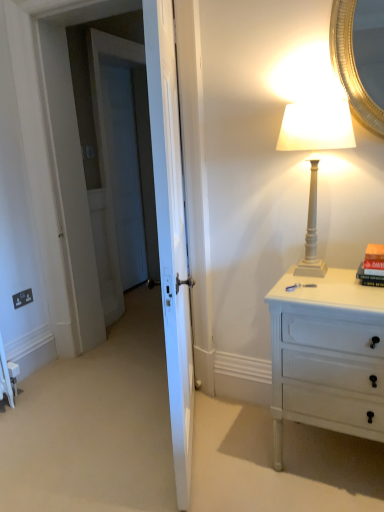
Question: Which is correct: white painted wood chest of drawers at right is inside white matte lamp at upper right, or outside of it?

Choices:
 (A) inside
 (B) outside

Answer: (B)

Question: Considering the relative positions of white painted wood chest of drawers at right and white matte lamp at upper right in the image provided, is white painted wood chest of drawers at right to the left or to the right of white matte lamp at upper right?

Choices:
 (A) right
 (B) left

Answer: (A)

Question: Based on their relative distances, which object is farther from the white glossy door at center?

Choices:
 (A) black plastic electric outlet at lower left
 (B) white painted wood chest of drawers at right
 (C) white matte lamp at upper right
 (D) hardcover book at right

Answer: (A)

Question: Based on their relative distances, which object is nearer to the white matte lamp at upper right?

Choices:
 (A) hardcover book at right
 (B) white painted wood chest of drawers at right
 (C) white glossy door at center
 (D) black plastic electric outlet at lower left

Answer: (A)